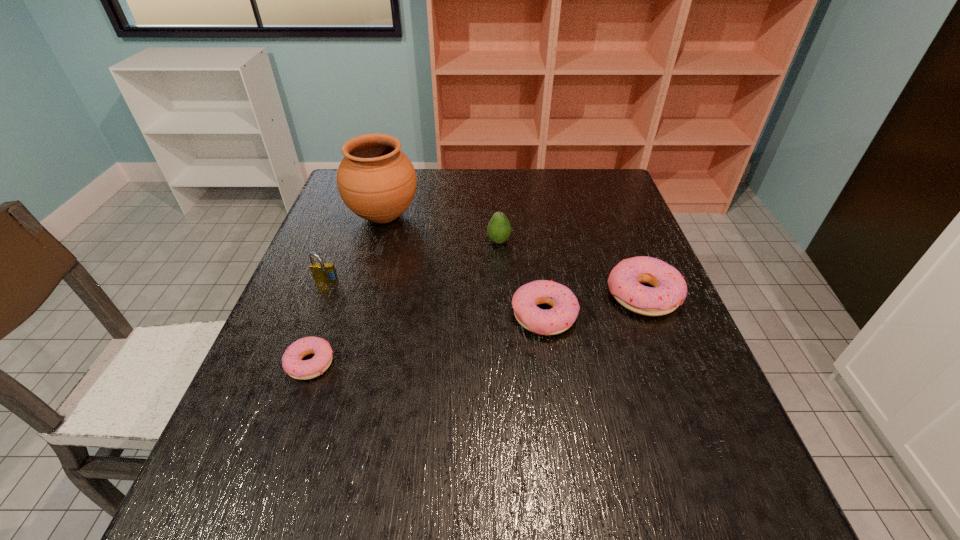
Where is `vacant space at the far edge of the desktop`? The height and width of the screenshot is (540, 960). vacant space at the far edge of the desktop is located at coordinates click(546, 170).

Where is `vacant position at the near edge of the desktop`? vacant position at the near edge of the desktop is located at coordinates (459, 422).

In the image, there is a desktop. Where is `blank space at the left edge`? This screenshot has height=540, width=960. blank space at the left edge is located at coordinates (x=365, y=233).

Locate an element on the screen. The width and height of the screenshot is (960, 540). vacant space at the right edge is located at coordinates (627, 233).

The width and height of the screenshot is (960, 540). In the image, there is a desktop. In order to click on blank space at the far right corner in this screenshot , I will do `click(577, 207)`.

In order to click on vacant space at the near right corner in this screenshot , I will do coord(738,442).

Find the location of a particular element. The image size is (960, 540). empty space between the shortest object and the rightmost doughnut is located at coordinates (477, 329).

Locate an element on the screen. This screenshot has width=960, height=540. free point between the fifth tallest object and the tallest object is located at coordinates (464, 266).

The width and height of the screenshot is (960, 540). Identify the location of free space between the avocado and the nearest doughnut. (404, 302).

Where is `empty space that is in between the second shortest object and the padlock`? empty space that is in between the second shortest object and the padlock is located at coordinates (x=435, y=299).